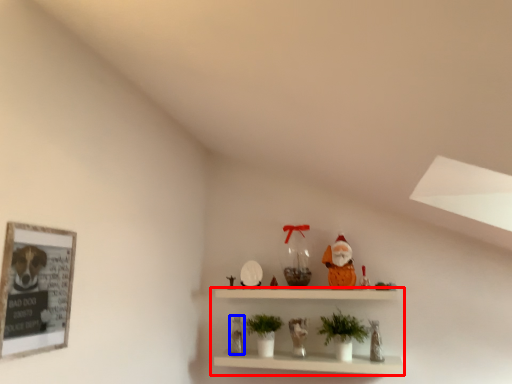
Question: Which point is further to the camera, shelf (highlighted by a red box) or toy (highlighted by a blue box)?

Choices:
 (A) shelf
 (B) toy

Answer: (B)